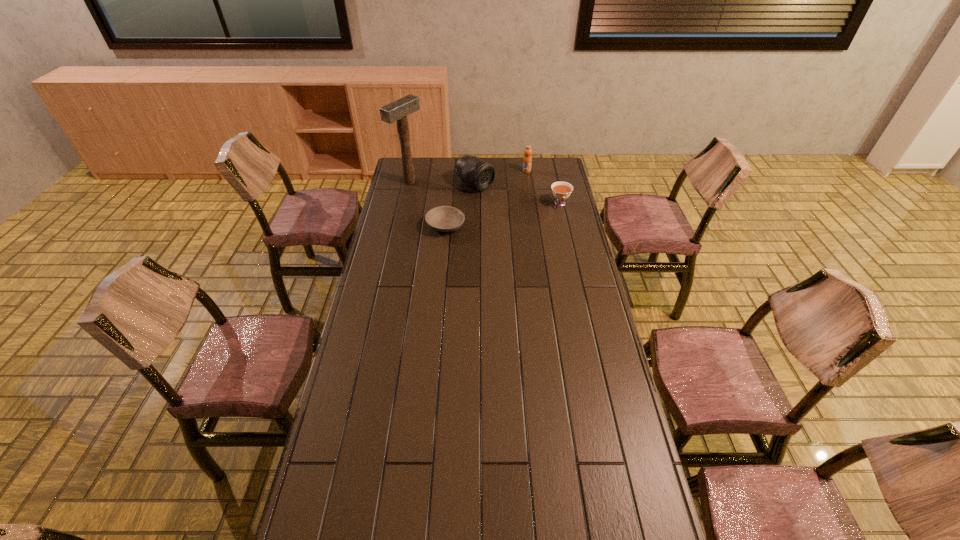
This screenshot has height=540, width=960. What are the coordinates of `telephoto lens present at the far edge` in the screenshot? It's located at (479, 174).

Where is `orange juice that is at the far edge`? The width and height of the screenshot is (960, 540). orange juice that is at the far edge is located at coordinates (527, 160).

Find the location of `object at the left edge`. object at the left edge is located at coordinates (398, 110).

Identify the location of object at the right edge. point(561,190).

I want to click on object present at the far left corner, so click(398, 110).

Identify the location of vacant space at the far edge of the desktop. (517, 177).

Where is `vacant area at the left edge of the desktop`? Image resolution: width=960 pixels, height=540 pixels. vacant area at the left edge of the desktop is located at coordinates (371, 481).

Find the location of `vacant region at the right edge`. vacant region at the right edge is located at coordinates (561, 259).

Locate an element on the screen. free region at the far left corner of the desktop is located at coordinates (426, 163).

In the image, there is a desktop. Where is `vacant space at the far right corner`? This screenshot has width=960, height=540. vacant space at the far right corner is located at coordinates 544,179.